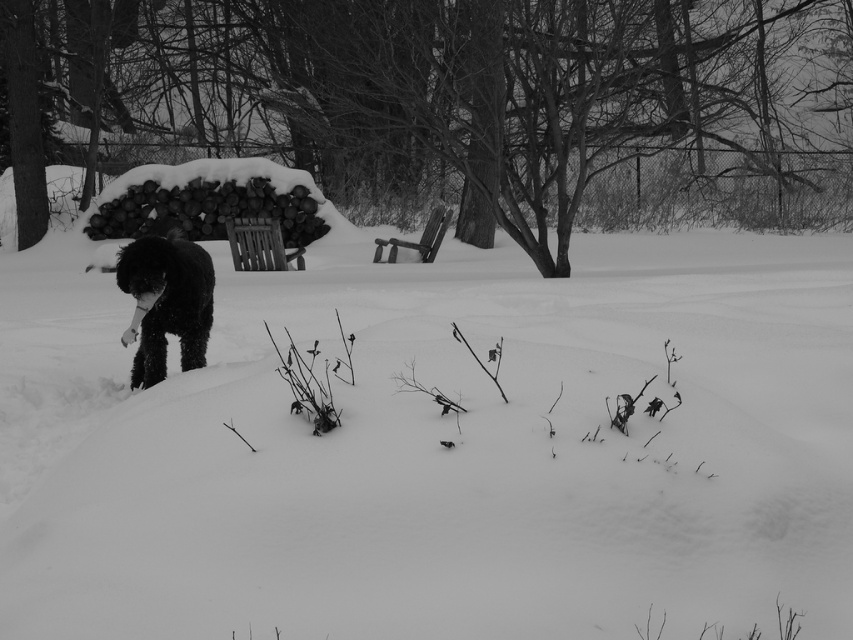
You are standing in the snowy scene and want to walk from the black fluffy dog at left to the white fluffy snow at center. Which direction should you face to walk directly towards the snow?

You should face to the right because the white fluffy snow at center is located to the right of the black fluffy dog at left.

You are standing in the snowy scene and want to take a closer look at the white fluffy snow at center and the black fluffy dog at left. Which object will appear larger in your view as you approach them?

The white fluffy snow at center will appear larger in your view because it is closer to the viewer than the black fluffy dog at left, so as you approach, its size in your field of view increases more rapidly compared to the dog which is farther away.